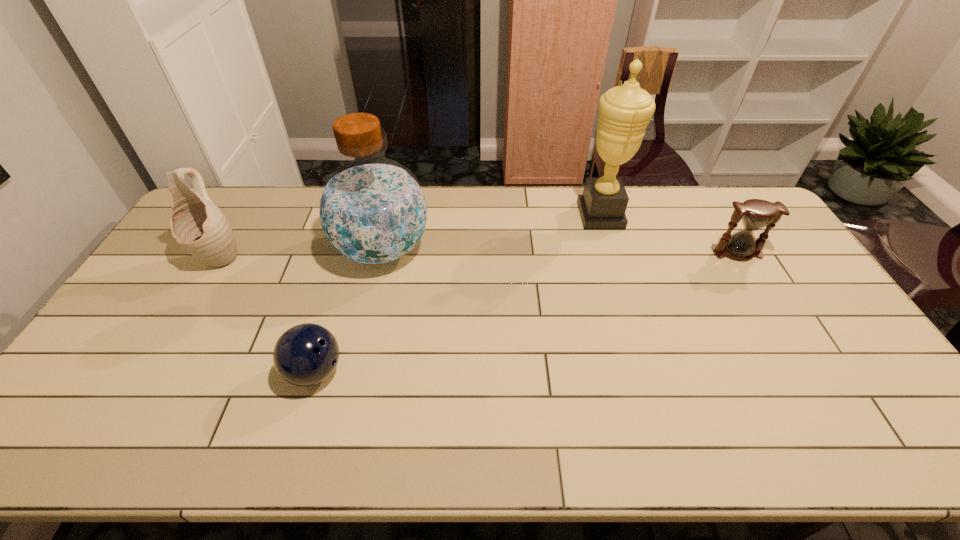
Where is `free area in between the pitcher and the second shortest object`? free area in between the pitcher and the second shortest object is located at coordinates (478, 255).

This screenshot has height=540, width=960. Identify the location of unoccupied area between the shortest object and the rightmost object. 526,312.

At what (x,y) coordinates should I click in order to perform the action: click on vacant area that lies between the pitcher and the hourglass. Please return your answer as a coordinate pair (x, y). Looking at the image, I should click on (478, 255).

Identify the location of vacant point located between the bowling ball and the fourth object from left to right. (458, 293).

I want to click on the closest object to the fourth shortest object, so [306, 354].

Locate which object ranks second in proximity to the trophy cup. Please provide its 2D coordinates. Your answer should be formatted as a tuple, i.e. [(x, y)], where the tuple contains the x and y coordinates of a point satisfying the conditions above.

[(372, 211)]

The height and width of the screenshot is (540, 960). Identify the location of vacant space that satisfies the following two spatial constraints: 1. on the back side of the second shortest object; 2. at the front of the tallest object with handles. (714, 215).

This screenshot has width=960, height=540. In order to click on vacant region that satisfies the following two spatial constraints: 1. on the front side of the rightmost object; 2. on the surface of the shortest object near the finger holes in this screenshot , I will do `click(807, 372)`.